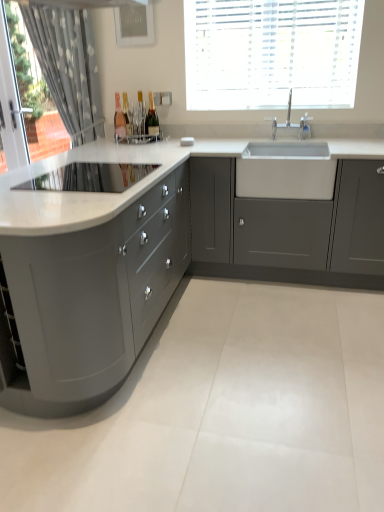
Question: Relative to white ceramic tap at upper center, is white textured blinds at upper center in front or behind?

Choices:
 (A) behind
 (B) front

Answer: (B)

Question: Is point (299, 74) closer or farther from the camera than point (302, 125)?

Choices:
 (A) farther
 (B) closer

Answer: (A)

Question: Which of these objects is positioned farthest from the clear glass bottle at center, marked as the second bottle in a right-to-left arrangement?

Choices:
 (A) white glossy drawer at center
 (B) matte gray cabinet at center, marked as the first cabinetry in a right-to-left arrangement
 (C) matte gray cabinets at left, which is the 1th cabinetry in left-to-right order
 (D) white textured blinds at upper center
 (E) gray fabric curtain at left

Answer: (C)

Question: Considering the real-world distances, which object is closest to the white ceramic tap at upper center?

Choices:
 (A) white textured blinds at upper center
 (B) matte gray cabinet at center, marked as the first cabinetry in a right-to-left arrangement
 (C) white glossy drawer at center
 (D) gray fabric curtain at left
 (E) matte gray cabinets at left, which is the 1th cabinetry in left-to-right order

Answer: (A)